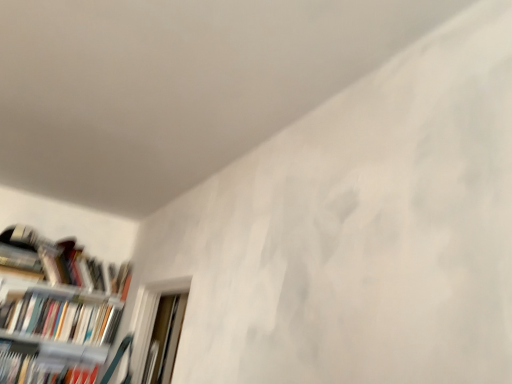
Question: Does white plastic bookcase at lower left have a lesser height compared to white glossy bookshelf at left, acting as the 2th book starting from the top?

Choices:
 (A) yes
 (B) no

Answer: (B)

Question: Is white plastic bookcase at lower left placed right next to white glossy bookshelf at left, acting as the 2th book starting from the top?

Choices:
 (A) yes
 (B) no

Answer: (A)

Question: From a real-world perspective, is white plastic bookcase at lower left located higher than white glossy bookshelf at left, acting as the 2th book starting from the top?

Choices:
 (A) no
 (B) yes

Answer: (A)

Question: From the image's perspective, is white plastic bookcase at lower left under white glossy bookshelf at left, acting as the 2th book starting from the top?

Choices:
 (A) no
 (B) yes

Answer: (B)

Question: Is the position of white plastic bookcase at lower left more distant than that of white glossy bookshelf at left, acting as the 2th book starting from the top?

Choices:
 (A) yes
 (B) no

Answer: (B)

Question: From the image's perspective, is white plastic bookcase at lower left positioned above or below hardcover book at left, the third book from the bottom?

Choices:
 (A) below
 (B) above

Answer: (A)

Question: From a real-world perspective, relative to hardcover book at left, the third book from the bottom, is white plastic bookcase at lower left vertically above or below?

Choices:
 (A) above
 (B) below

Answer: (B)

Question: Based on their sizes in the image, would you say white plastic bookcase at lower left is bigger or smaller than hardcover book at left, marked as the first book in a top-to-bottom arrangement?

Choices:
 (A) big
 (B) small

Answer: (A)

Question: Is white plastic bookcase at lower left in front of or behind hardcover book at left, marked as the first book in a top-to-bottom arrangement, in the image?

Choices:
 (A) behind
 (B) front

Answer: (B)

Question: From the image's perspective, is white glossy bookshelf at left, placed as the 2th book when sorted from bottom to top, positioned above or below white plastic bookcase at lower left?

Choices:
 (A) above
 (B) below

Answer: (A)

Question: Considering the relative positions of white glossy bookshelf at left, acting as the 2th book starting from the top, and white plastic bookcase at lower left in the image provided, is white glossy bookshelf at left, acting as the 2th book starting from the top, to the left or to the right of white plastic bookcase at lower left?

Choices:
 (A) right
 (B) left

Answer: (A)

Question: Is white glossy bookshelf at left, placed as the 2th book when sorted from bottom to top, bigger or smaller than white plastic bookcase at lower left?

Choices:
 (A) small
 (B) big

Answer: (A)

Question: Considering their positions, is white glossy bookshelf at left, placed as the 2th book when sorted from bottom to top, located in front of or behind white plastic bookcase at lower left?

Choices:
 (A) behind
 (B) front

Answer: (A)

Question: Is hardcover book at left, the third book from the bottom, bigger or smaller than white plastic bookcase at lower left?

Choices:
 (A) big
 (B) small

Answer: (B)

Question: Relative to white plastic bookcase at lower left, is hardcover book at left, marked as the first book in a top-to-bottom arrangement, in front or behind?

Choices:
 (A) front
 (B) behind

Answer: (B)